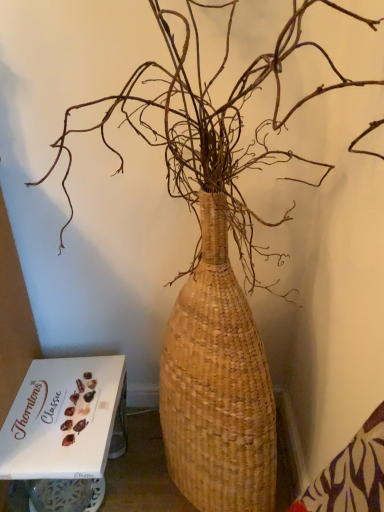
Locate an element on the screen. Image resolution: width=384 pixels, height=512 pixels. free point above white cardboard box at lower left (from a real-world perspective) is located at coordinates (x=67, y=404).